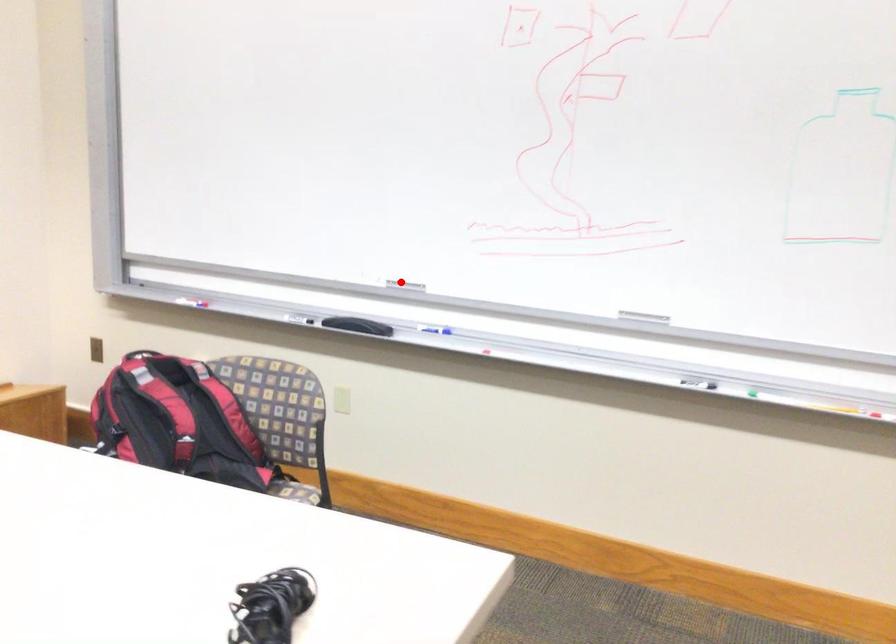
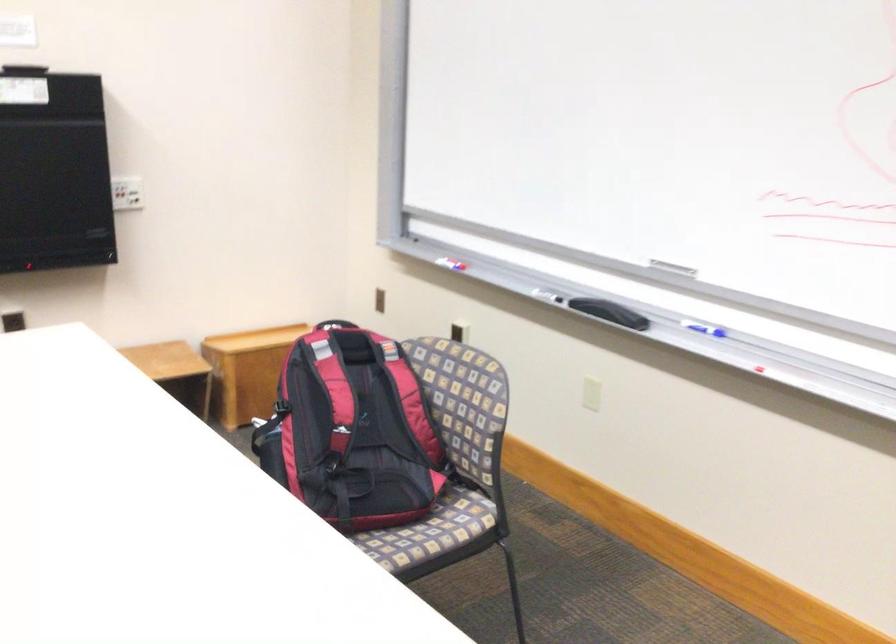
Question: I am providing you with two images of the same scene from different viewpoints. In image1, a red point is highlighted. Considering the same 3D point in image2, which of the following is correct?

Choices:
 (A) It is closer
 (B) It is farther

Answer: (A)